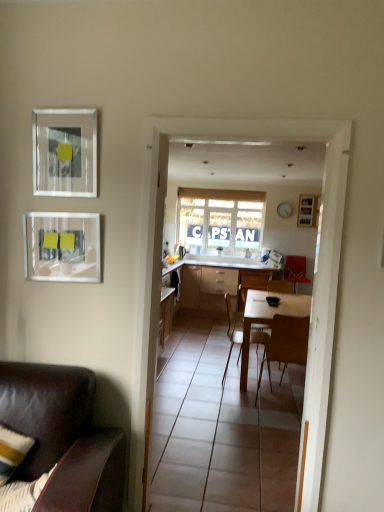
Question: Is matte glass picture frame at upper left, which is counted as the second picture frame, starting from the back, inside white glossy table at center?

Choices:
 (A) no
 (B) yes

Answer: (A)

Question: Is white glossy table at center smaller than matte glass picture frame at upper left, the first picture frame in the left-to-right sequence?

Choices:
 (A) no
 (B) yes

Answer: (A)

Question: From a real-world perspective, is white glossy table at center on matte glass picture frame at upper left, the first picture frame in the left-to-right sequence?

Choices:
 (A) no
 (B) yes

Answer: (A)

Question: Would you say white glossy table at center is outside matte glass picture frame at upper left, acting as the 2th picture frame starting from the front?

Choices:
 (A) no
 (B) yes

Answer: (B)

Question: Can you confirm if white glossy table at center is bigger than matte glass picture frame at upper left, which is counted as the second picture frame, starting from the back?

Choices:
 (A) yes
 (B) no

Answer: (A)

Question: In the image, is wooden picture frame at upper right, which ranks as the first picture frame in right-to-left order, on the left side or the right side of brown leather chair at lower left, marked as the fifth chair in a back-to-front arrangement?

Choices:
 (A) left
 (B) right

Answer: (B)

Question: From the image's perspective, is wooden picture frame at upper right, the 1th picture frame when ordered from top to bottom, positioned above or below brown leather chair at lower left, which ranks as the first chair in front-to-back order?

Choices:
 (A) below
 (B) above

Answer: (B)

Question: Considering the positions of wooden picture frame at upper right, which ranks as the 3th picture frame in left-to-right order, and brown leather chair at lower left, the first chair from the left, in the image, is wooden picture frame at upper right, which ranks as the 3th picture frame in left-to-right order, taller or shorter than brown leather chair at lower left, the first chair from the left,?

Choices:
 (A) tall
 (B) short

Answer: (B)

Question: Is point (304, 210) positioned closer to the camera than point (102, 433)?

Choices:
 (A) farther
 (B) closer

Answer: (A)

Question: Looking at the image, does velvet red chair at right, the first chair positioned from the right, seem bigger or smaller compared to wooden chair at center, which is the fourth chair from right to left?

Choices:
 (A) big
 (B) small

Answer: (B)

Question: Is point (304, 283) positioned closer to the camera than point (228, 330)?

Choices:
 (A) closer
 (B) farther

Answer: (B)

Question: Considering their positions, is velvet red chair at right, arranged as the 5th chair when viewed from the left, located in front of or behind wooden chair at center, marked as the third chair in a front-to-back arrangement?

Choices:
 (A) behind
 (B) front

Answer: (A)

Question: Is velvet red chair at right, the first chair positioned from the right, wider or thinner than wooden chair at center, which is the third chair from back to front?

Choices:
 (A) thin
 (B) wide

Answer: (B)

Question: Looking at their shapes, would you say matte glass picture frame at upper left, which ranks as the first picture frame in bottom-to-top order, is wider or thinner than white glossy table at center?

Choices:
 (A) wide
 (B) thin

Answer: (B)

Question: In terms of size, does matte glass picture frame at upper left, which ranks as the first picture frame in bottom-to-top order, appear bigger or smaller than white glossy table at center?

Choices:
 (A) small
 (B) big

Answer: (A)